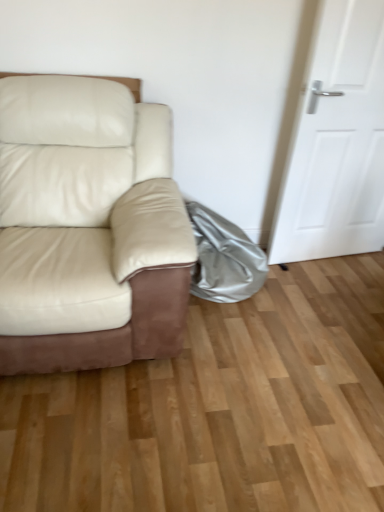
Locate an element on the screen. free space in front of white matte door at right is located at coordinates (336, 293).